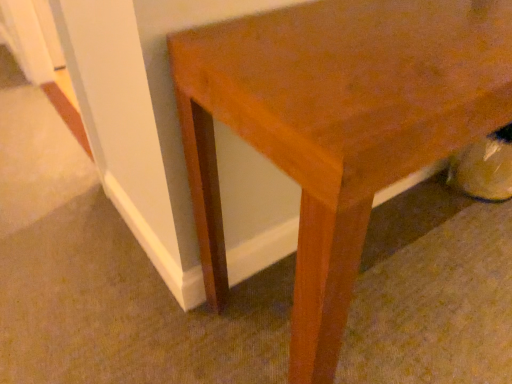
The image size is (512, 384). What do you see at coordinates (336, 126) in the screenshot?
I see `wooden table at center` at bounding box center [336, 126].

Locate an element on the screen. The width and height of the screenshot is (512, 384). wooden table at center is located at coordinates (336, 126).

Find the location of a particular element. The width and height of the screenshot is (512, 384). wooden table at center is located at coordinates (336, 126).